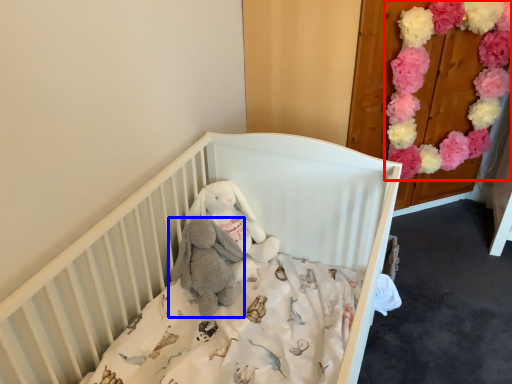
Question: Which point is further to the camera, flower (highlighted by a red box) or baby elephant (highlighted by a blue box)?

Choices:
 (A) flower
 (B) baby elephant

Answer: (A)